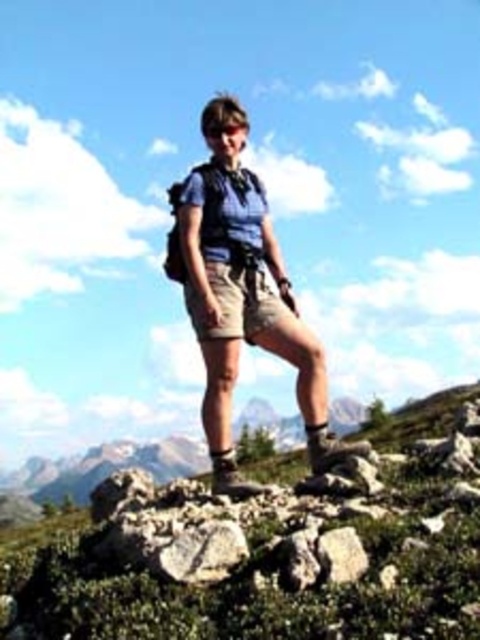
You are a drone operator trying to capture a photo of the person standing on the rocky terrain. The drone is currently at a position 10 meters away from the person. You need to adjust the drone to get closer to the point at coordinates point (x=211, y=332). How much closer should you move the drone to reach that point?

The distance of point (x=211, y=332) from camera is 8.90 meters. Since the drone is currently at 10 meters away, you need to move it 1.10 meters closer to reach the desired point.